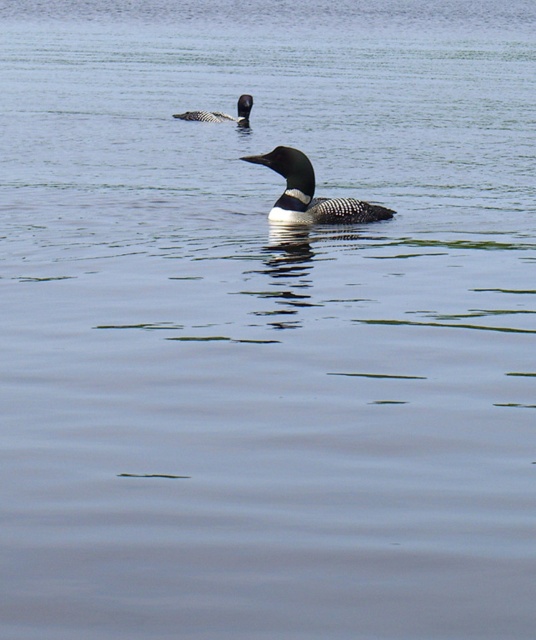
Is greenish-gray feathers at center further to the viewer compared to dark gray matte duck at upper center?

That is False.

Can you confirm if greenish-gray feathers at center is wider than dark gray matte duck at upper center?

Yes.

Is point (278, 208) closer to camera compared to point (240, 112)?

Yes, it is in front of point (240, 112).

Where is `greenish-gray feathers at center`? Image resolution: width=536 pixels, height=640 pixels. greenish-gray feathers at center is located at coordinates (310, 193).